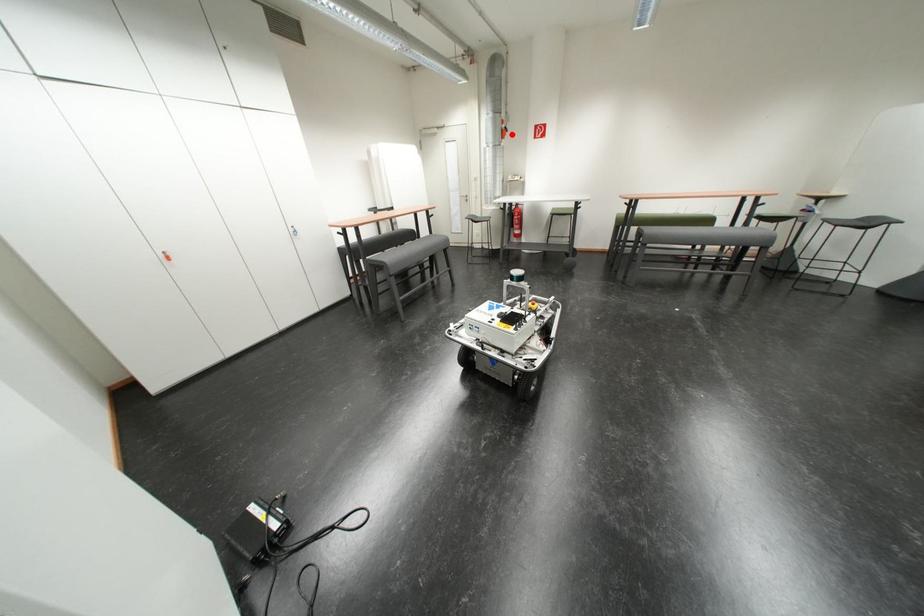
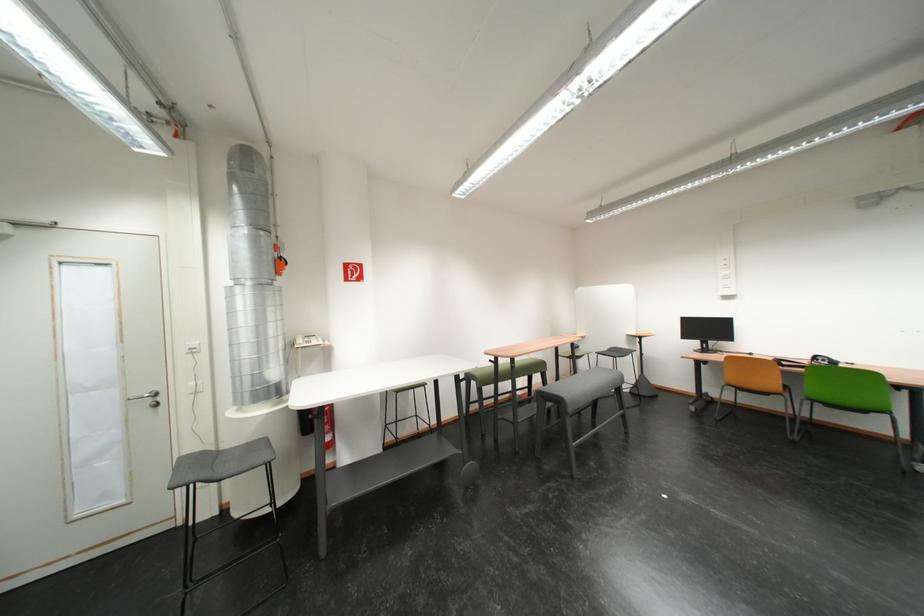
Question: I am providing you with two images of the same scene from different viewpoints. Image1 has a red point marked. In image2, the corresponding 3D location appears at what relative position? Reply with the corresponding letter.

Choices:
 (A) Closer
 (B) Farther

Answer: (B)